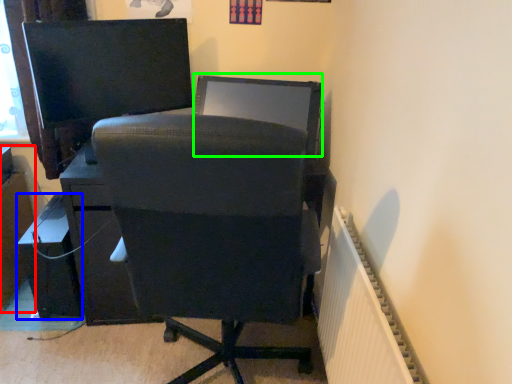
Question: Estimate the real-world distances between objects in this image. Which object is farther from file cabinet (highlighted by a red box), furniture (highlighted by a blue box) or computer monitor (highlighted by a green box)?

Choices:
 (A) furniture
 (B) computer monitor

Answer: (B)